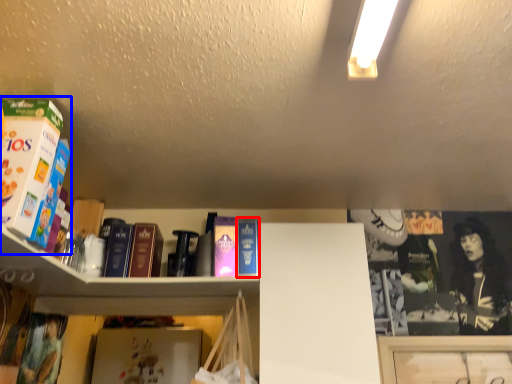
Question: Among these objects, which one is nearest to the camera, paperback book (highlighted by a red box) or book (highlighted by a blue box)?

Choices:
 (A) paperback book
 (B) book

Answer: (B)